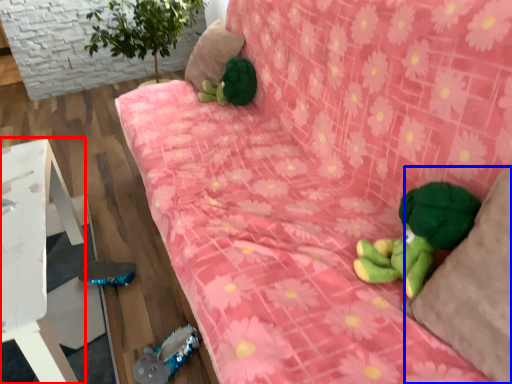
Question: Which point is closer to the camera, furniture (highlighted by a red box) or pillow (highlighted by a blue box)?

Choices:
 (A) furniture
 (B) pillow

Answer: (B)